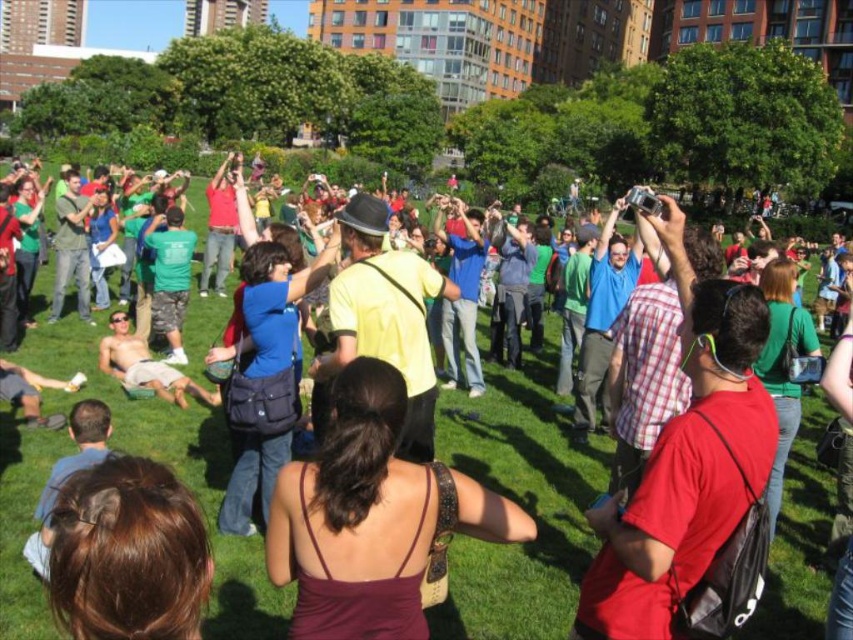
Question: Where is red matte shirt at center located in relation to tan skin shirtless man at center in the image?

Choices:
 (A) above
 (B) below

Answer: (B)

Question: From the image, what is the correct spatial relationship of maroon fabric dress at center in relation to tan skin shirtless man at center?

Choices:
 (A) left
 (B) right

Answer: (B)

Question: Is maroon fabric dress at center smaller than red matte shirt at center?

Choices:
 (A) no
 (B) yes

Answer: (A)

Question: Based on their relative distances, which object is nearer to the maroon fabric dress at center?

Choices:
 (A) red matte shirt at center
 (B) tan skin shirtless man at center

Answer: (A)

Question: Which object is farther from the camera taking this photo?

Choices:
 (A) red matte shirt at center
 (B) maroon fabric dress at center

Answer: (A)

Question: Which point appears farthest from the camera in this image?

Choices:
 (A) (123, 310)
 (B) (630, 570)

Answer: (A)